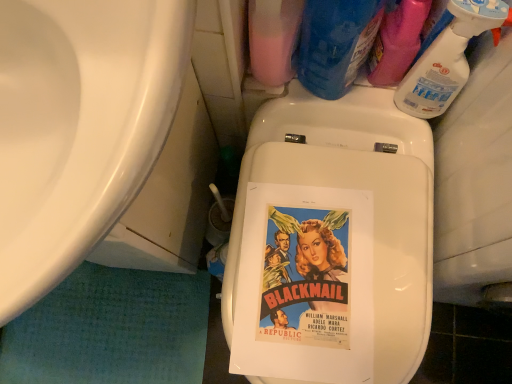
Question: Is blue plastic bottle at upper right, the second cleaning product viewed from the left, oriented towards pink matte bottle at upper center, the 1th cleaning product positioned from the left?

Choices:
 (A) yes
 (B) no

Answer: (B)

Question: Is blue plastic bottle at upper right, which is the 3th cleaning product from right to left, closer to camera compared to pink matte bottle at upper center, which ranks as the fourth cleaning product in right-to-left order?

Choices:
 (A) yes
 (B) no

Answer: (B)

Question: From a real-world perspective, does blue plastic bottle at upper right, the second cleaning product viewed from the left, sit lower than pink matte bottle at upper center, which ranks as the fourth cleaning product in right-to-left order?

Choices:
 (A) yes
 (B) no

Answer: (A)

Question: Can you confirm if blue plastic bottle at upper right, the second cleaning product viewed from the left, is wider than pink matte bottle at upper center, the 1th cleaning product positioned from the left?

Choices:
 (A) no
 (B) yes

Answer: (B)

Question: Can pink matte bottle at upper center, the 1th cleaning product positioned from the left, be found inside blue plastic bottle at upper right, which is the 3th cleaning product from right to left?

Choices:
 (A) no
 (B) yes

Answer: (A)

Question: Is blue plastic bottle at upper right, the second cleaning product viewed from the left, next to pink matte bottle at upper center, the 1th cleaning product positioned from the left?

Choices:
 (A) no
 (B) yes

Answer: (B)

Question: Is pink matte bottle at upper center, which ranks as the fourth cleaning product in right-to-left order, shorter than white glossy sink at left?

Choices:
 (A) no
 (B) yes

Answer: (A)

Question: Considering the relative positions of pink matte bottle at upper center, the 1th cleaning product positioned from the left, and white glossy sink at left in the image provided, is pink matte bottle at upper center, the 1th cleaning product positioned from the left, to the left of white glossy sink at left from the viewer's perspective?

Choices:
 (A) yes
 (B) no

Answer: (B)

Question: From a real-world perspective, is pink matte bottle at upper center, the 1th cleaning product positioned from the left, under white glossy sink at left?

Choices:
 (A) yes
 (B) no

Answer: (A)

Question: Considering the relative sizes of pink matte bottle at upper center, the 1th cleaning product positioned from the left, and white glossy sink at left in the image provided, is pink matte bottle at upper center, the 1th cleaning product positioned from the left, wider than white glossy sink at left?

Choices:
 (A) no
 (B) yes

Answer: (A)

Question: From a real-world perspective, is pink matte bottle at upper center, which ranks as the fourth cleaning product in right-to-left order, located higher than white glossy sink at left?

Choices:
 (A) yes
 (B) no

Answer: (B)

Question: Is pink matte bottle at upper center, the 1th cleaning product positioned from the left, not inside white glossy sink at left?

Choices:
 (A) yes
 (B) no

Answer: (A)

Question: Is pink matte bottle at upper center, the 1th cleaning product positioned from the left, bigger than blue plastic bottle at upper right, the second cleaning product viewed from the left?

Choices:
 (A) no
 (B) yes

Answer: (B)